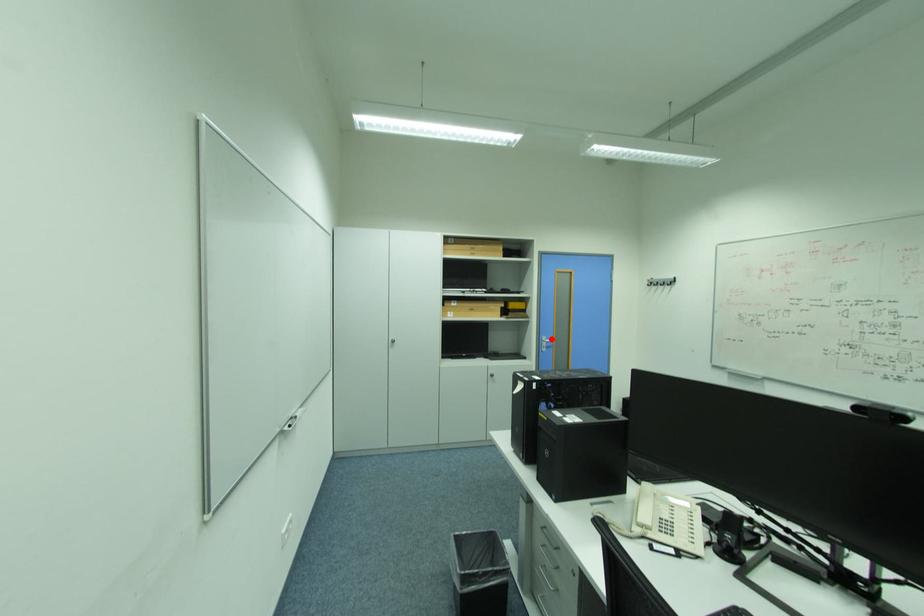
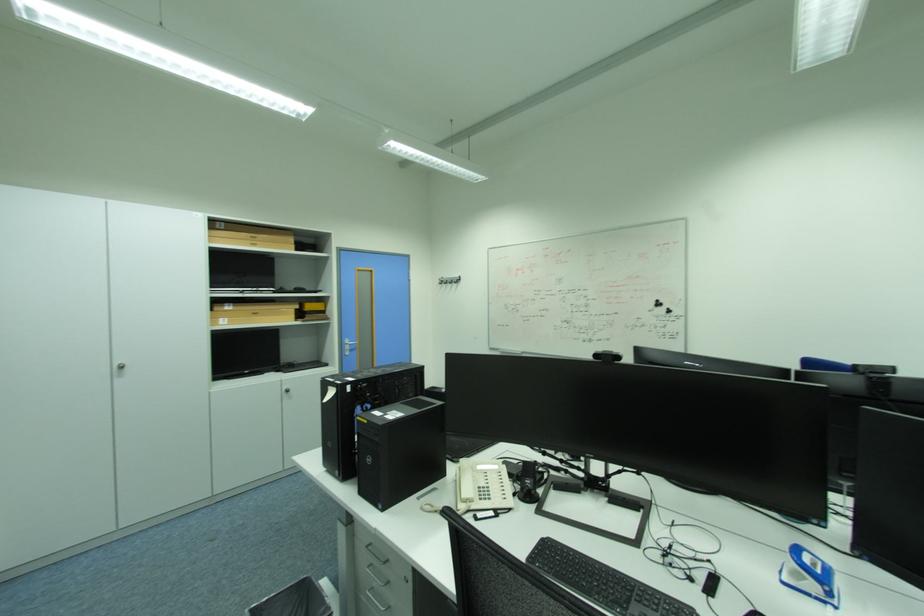
In the second image, find the point that corresponds to the highlighted location in the first image.

(355, 342)